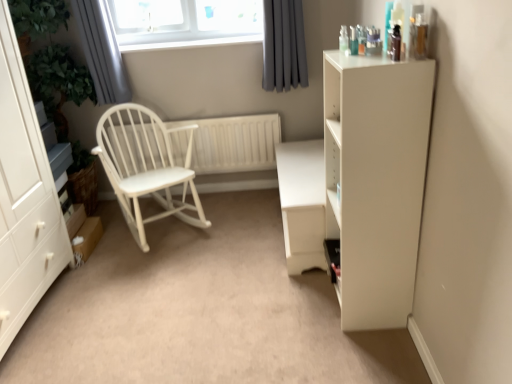
You are a GUI agent. You are given a task and a screenshot of the screen. Output one action in this format:
    pyautogui.click(x=<x>, y=<y>)
    Task: Click on the free space that is in between white wood rocking chair at left and white matte cabinet at right
    The width and height of the screenshot is (512, 384).
    Given the screenshot: What is the action you would take?
    pyautogui.click(x=239, y=260)